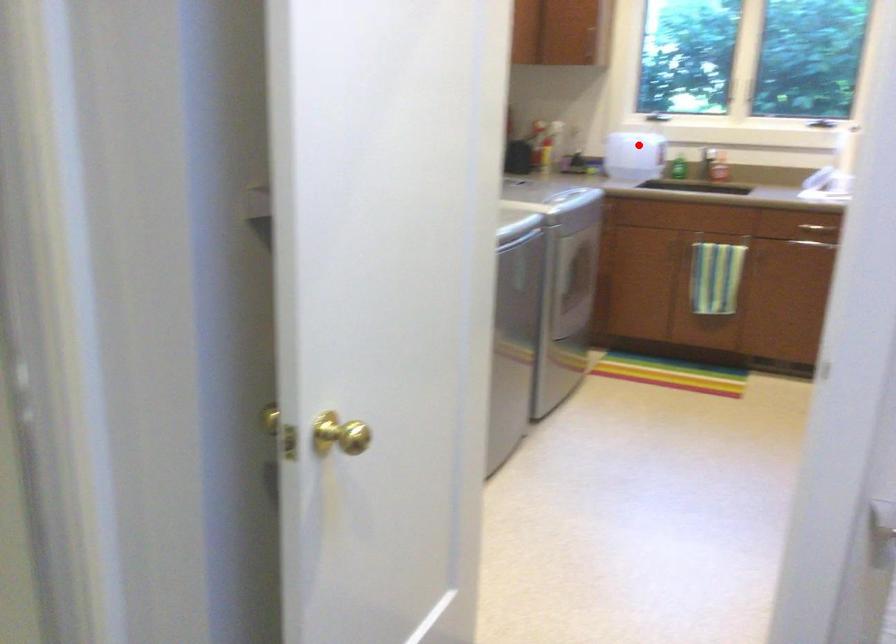
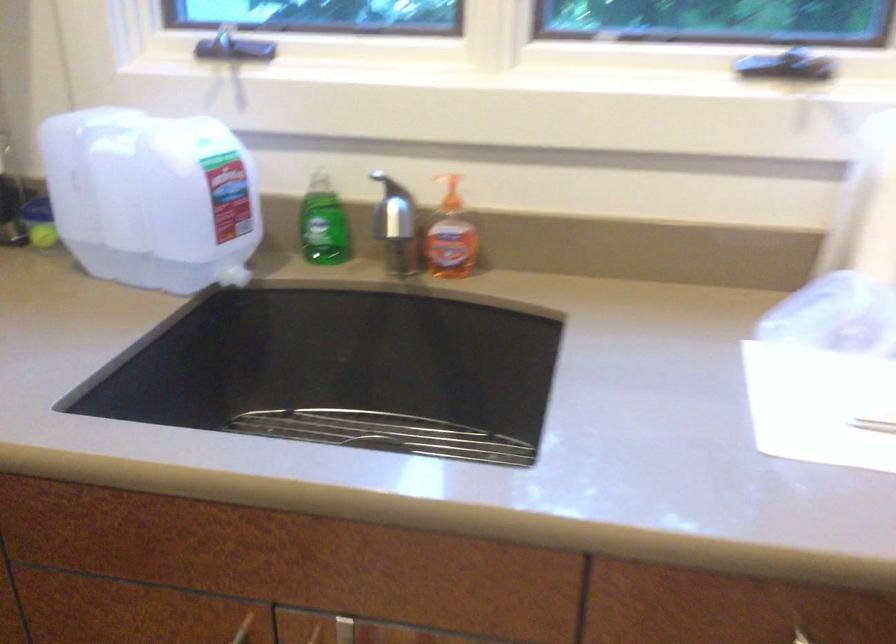
The point at the highlighted location is marked in the first image. Where is the corresponding point in the second image?

(151, 198)